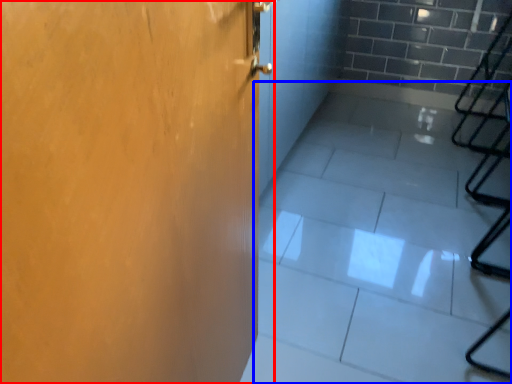
Question: Which of the following is the farthest to the observer, door (highlighted by a red box) or concrete (highlighted by a blue box)?

Choices:
 (A) door
 (B) concrete

Answer: (B)